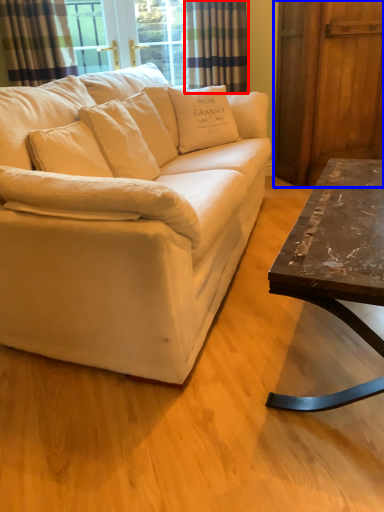
Question: Which object is closer to the camera taking this photo, curtain (highlighted by a red box) or barn door (highlighted by a blue box)?

Choices:
 (A) curtain
 (B) barn door

Answer: (B)